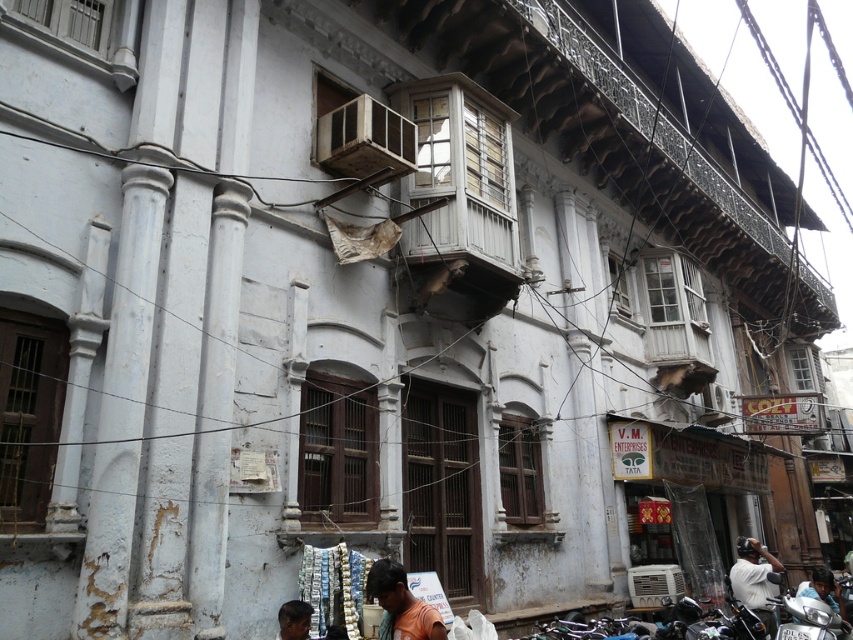
You are a delivery person who needs to park your silver metallic motorcycle at lower right. The parking spot is located at coordinates point (810,618). Is your motorcycle already parked in the correct spot?

The silver metallic motorcycle at lower right is represented by point (810,618), so yes, the motorcycle is already parked in the correct spot.